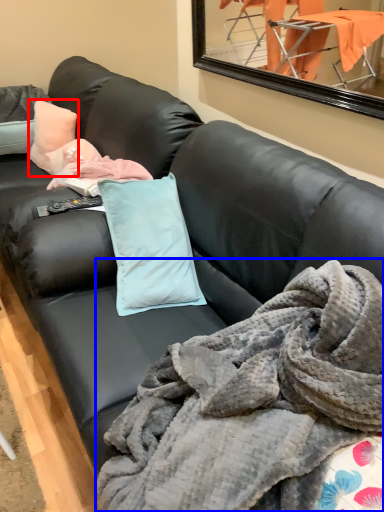
Question: Which object is closer to the camera taking this photo, pillow (highlighted by a red box) or blanket (highlighted by a blue box)?

Choices:
 (A) pillow
 (B) blanket

Answer: (B)